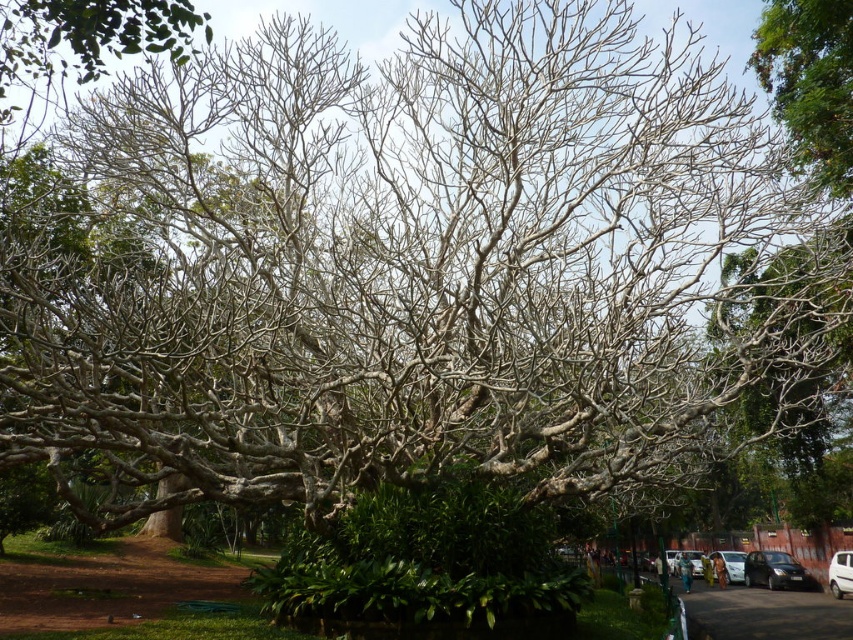
Which is below, metallic silver car at lower right or metallic silver car at center?

metallic silver car at center

Describe the element at coordinates (729, 564) in the screenshot. I see `metallic silver car at lower right` at that location.

This screenshot has height=640, width=853. I want to click on metallic silver car at lower right, so [729, 564].

Is white glossy car at center below metallic silver car at lower right?

No.

Can you confirm if white glossy car at center is bigger than metallic silver car at lower right?

Incorrect, white glossy car at center is not larger than metallic silver car at lower right.

Is point (839, 552) closer to camera compared to point (726, 556)?

Yes.

The height and width of the screenshot is (640, 853). What are the coordinates of `white glossy car at center` in the screenshot? It's located at (840, 573).

Is the position of shiny black car at lower right more distant than that of white glossy car at center?

Yes.

Is point (764, 572) positioned after point (839, 582)?

Yes, point (764, 572) is farther from viewer.

Find the location of `shiny black car at lower right`. shiny black car at lower right is located at coordinates (775, 570).